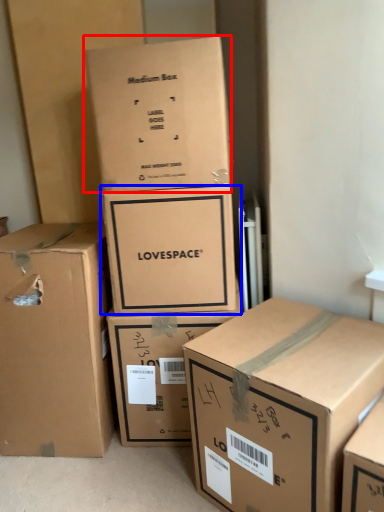
Question: Which point is closer to the camera, box (highlighted by a red box) or box (highlighted by a blue box)?

Choices:
 (A) box
 (B) box

Answer: (A)